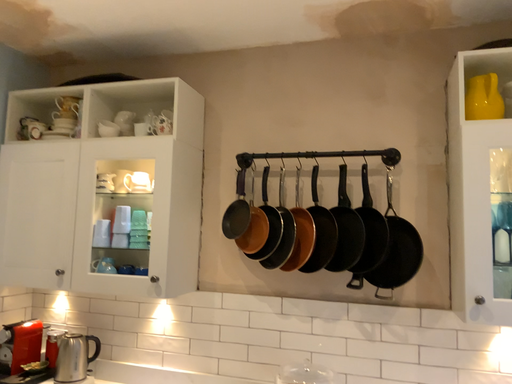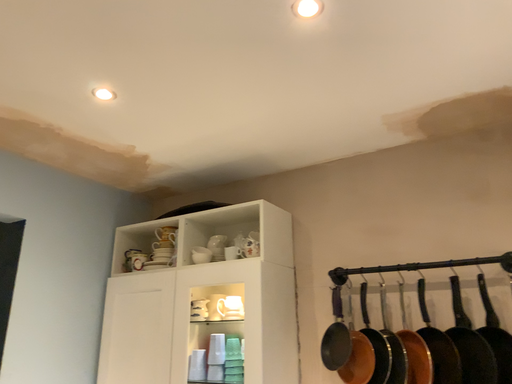
Question: How did the camera likely rotate when shooting the video?

Choices:
 (A) rotated downward
 (B) rotated upward

Answer: (B)